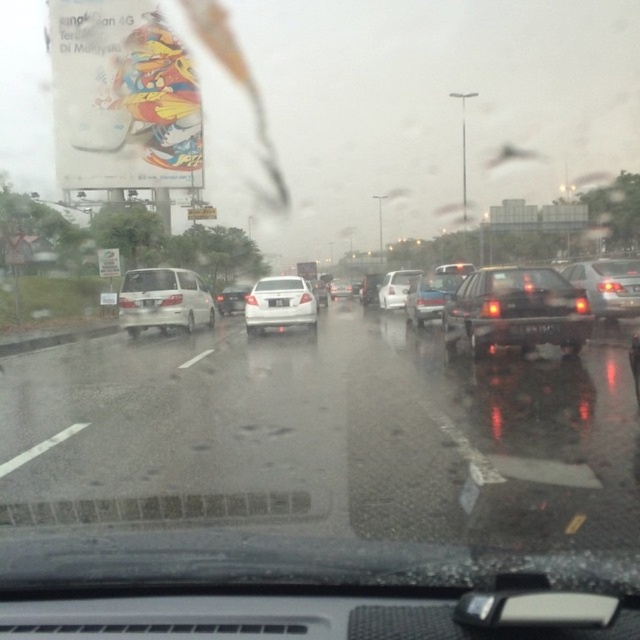
Can you confirm if satin silver sedan at right is positioned below shiny black sedan at center?

Actually, satin silver sedan at right is above shiny black sedan at center.

Is point (634, 259) positioned behind point (636, 360)?

Yes.

The width and height of the screenshot is (640, 640). I want to click on satin silver sedan at right, so click(608, 285).

Between point (227, 292) and point (632, 374), which one is positioned in front?

Positioned in front is point (632, 374).

Can you confirm if satin silver sedan at center is shorter than shiny black sedan at center?

No.

This screenshot has width=640, height=640. Find the location of `satin silver sedan at center`. satin silver sedan at center is located at coordinates (232, 298).

Who is more distant from viewer, (x=304, y=320) or (x=330, y=296)?

The point (x=330, y=296) is more distant.

Describe the element at coordinates (280, 307) in the screenshot. I see `white matte sedan at center` at that location.

Locate an element on the screen. Image resolution: width=640 pixels, height=640 pixels. white matte sedan at center is located at coordinates (280, 307).